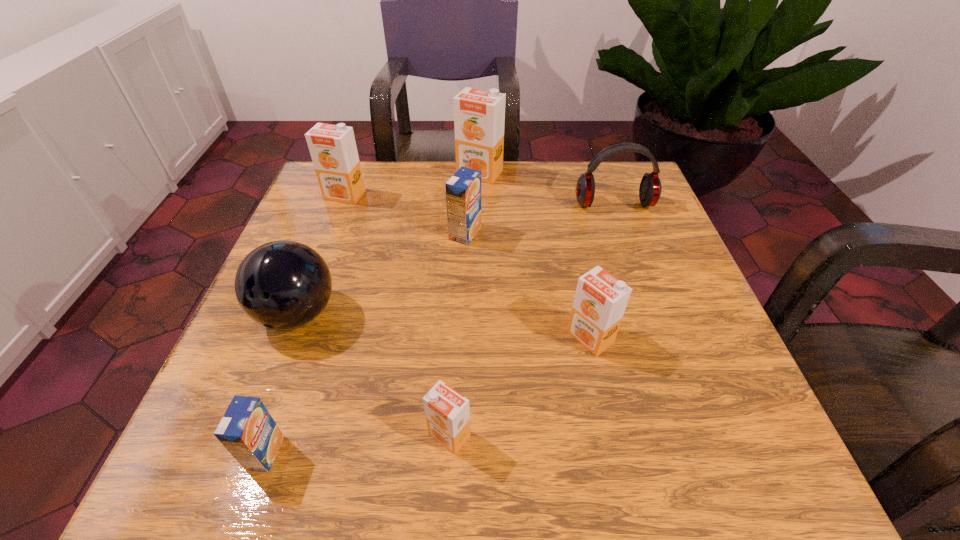
I want to click on the nearest orange orange juice, so click(x=447, y=412).

This screenshot has height=540, width=960. Identify the location of the smaller blue orange_juice. (247, 430).

Locate an element on the screen. Image resolution: width=960 pixels, height=540 pixels. the left blue orange_juice is located at coordinates (247, 430).

You are a GUI agent. You are given a task and a screenshot of the screen. Output one action in this format:
    pyautogui.click(x=<x>, y=<y>)
    Task: Click on the free space located on the left of the biggest orange orange juice
    Image resolution: width=960 pixels, height=540 pixels.
    Given the screenshot: What is the action you would take?
    pyautogui.click(x=361, y=173)

The width and height of the screenshot is (960, 540). I want to click on free space located 0.110m on the front of the fifth shortest orange_juice, so click(330, 234).

Identify the location of free location located on the ear cups of the red earphone. This screenshot has height=540, width=960. (622, 228).

Where is `vacant space located on the side of the black bowling ball with the finger holes`? This screenshot has width=960, height=540. vacant space located on the side of the black bowling ball with the finger holes is located at coordinates (248, 444).

This screenshot has width=960, height=540. I want to click on free space located 0.110m on the front of the fourth farthest object, so click(464, 282).

You are a GUI agent. You are given a task and a screenshot of the screen. Output one action in this format:
    pyautogui.click(x=<x>, y=<y>)
    Task: Click on the free space located 0.170m on the left of the rightmost orange_juice
    Image resolution: width=960 pixels, height=540 pixels.
    Given the screenshot: What is the action you would take?
    pyautogui.click(x=471, y=338)

Locate an element on the screen. The image size is (960, 540). vacant space situated 0.380m on the right of the nearest orange orange juice is located at coordinates (730, 435).